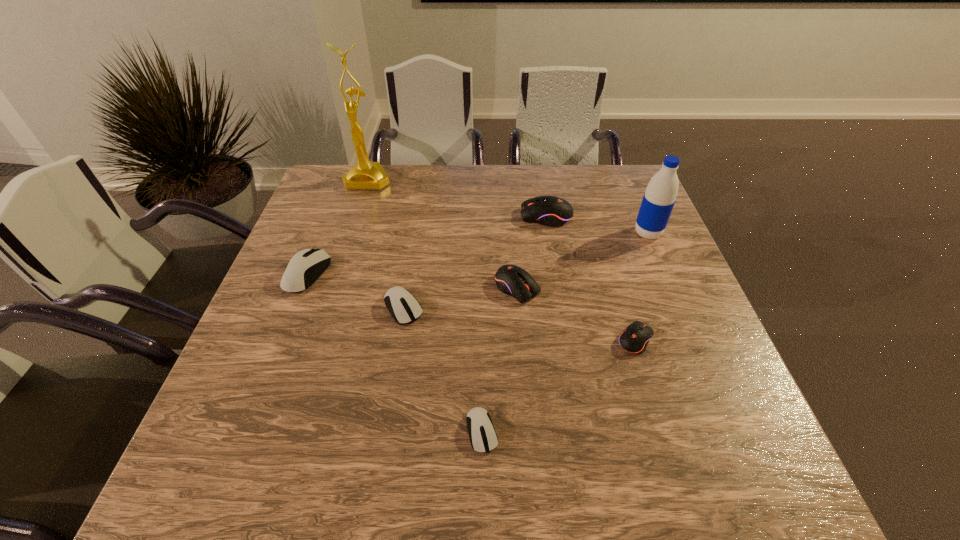
At what (x,y) coordinates should I click in order to perform the action: click on vacant region between the sixth shortest object and the blue water bottle. Please return your answer as a coordinate pair (x, y). Looking at the image, I should click on (597, 225).

The image size is (960, 540). I want to click on empty location between the third object from left to right and the leftmost mouse, so coord(355,291).

Locate an element on the screen. This screenshot has width=960, height=540. free spot between the nearest black computer mouse and the second nearest black computer mouse is located at coordinates (576, 314).

Find the location of a particular element. Image resolution: width=960 pixels, height=540 pixels. vacant region between the rightmost white mouse and the biggest white mouse is located at coordinates (395, 353).

This screenshot has width=960, height=540. What are the coordinates of `object that is the closest to the biggest black computer mouse` in the screenshot? It's located at (659, 198).

Identify which object is the fifth closest to the biggest white mouse. Please provide its 2D coordinates. Your answer should be formatted as a tuple, i.e. [(x, y)], where the tuple contains the x and y coordinates of a point satisfying the conditions above.

[(552, 211)]

Locate an element on the screen. The height and width of the screenshot is (540, 960). the second closest mouse to the leftmost white mouse is located at coordinates (512, 280).

You are a GUI agent. You are given a task and a screenshot of the screen. Output one action in this format:
    pyautogui.click(x=<x>, y=<y>)
    Task: Click on the mouse that is the third closest to the second smallest black computer mouse
    This screenshot has width=960, height=540.
    Given the screenshot: What is the action you would take?
    pyautogui.click(x=552, y=211)

The image size is (960, 540). What are the coordinates of `black computer mouse that is the second closest to the smallest black computer mouse` in the screenshot? It's located at (552, 211).

Where is `black computer mouse that stands as the third closest to the third object from left to right`? The image size is (960, 540). black computer mouse that stands as the third closest to the third object from left to right is located at coordinates point(635,338).